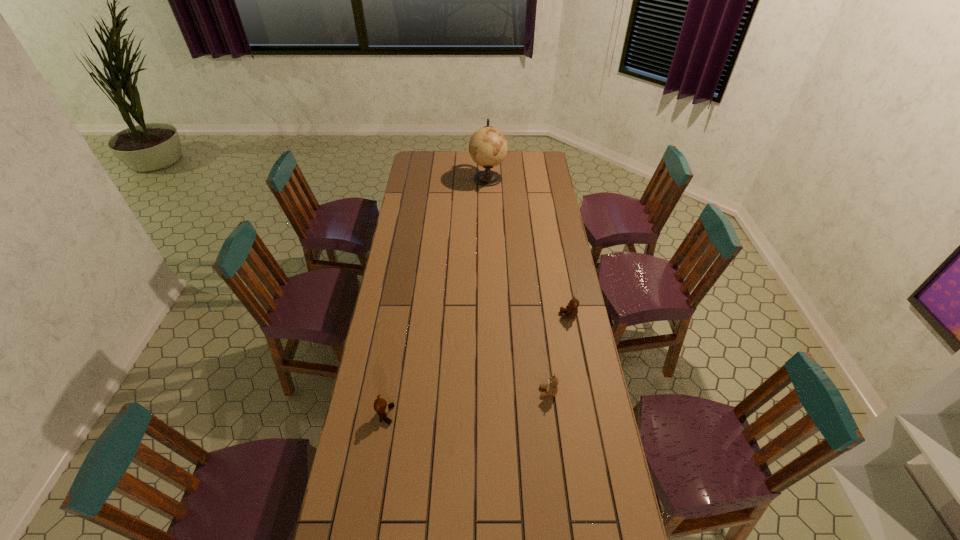
The width and height of the screenshot is (960, 540). I want to click on vacant region between the second nearest object and the rightmost object, so click(x=559, y=353).

This screenshot has height=540, width=960. I want to click on vacant space that is in between the second teddy bear from left to right and the farthest object, so click(517, 285).

Identify the location of free space between the farthest teddy bear and the leftmost object. (477, 365).

Image resolution: width=960 pixels, height=540 pixels. What are the coordinates of `the second closest object to the farthest teddy bear` in the screenshot? It's located at (381, 407).

Choose which object is the third nearest neighbor to the globe. Please provide its 2D coordinates. Your answer should be formatted as a tuple, i.e. [(x, y)], where the tuple contains the x and y coordinates of a point satisfying the conditions above.

[(381, 407)]

At what (x,y) coordinates should I click in order to perform the action: click on teddy bear that stands as the second closest to the second object from left to right. Please return your answer as a coordinate pair (x, y). The height and width of the screenshot is (540, 960). Looking at the image, I should click on (551, 388).

Where is `teddy bear that is the closest to the farthest teddy bear`? The image size is (960, 540). teddy bear that is the closest to the farthest teddy bear is located at coordinates (551, 388).